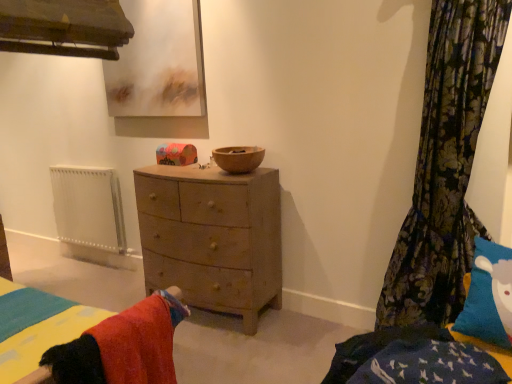
Question: Choose the correct answer: Is floral fabric curtain at right inside white metallic radiator at left or outside it?

Choices:
 (A) inside
 (B) outside

Answer: (B)

Question: Would you say floral fabric curtain at right is to the left or to the right of white metallic radiator at left in the picture?

Choices:
 (A) left
 (B) right

Answer: (B)

Question: Estimate the real-world distances between objects in this image. Which object is farther from the white metallic radiator at left?

Choices:
 (A) wooden chest of drawers at center
 (B) soft cotton bed at center
 (C) wooden bowl at center
 (D) floral fabric curtain at right
 (E) matte wooden picture frame at upper center

Answer: (D)

Question: Estimate the real-world distances between objects in this image. Which object is closer to the soft cotton bed at center?

Choices:
 (A) white metallic radiator at left
 (B) wooden bowl at center
 (C) floral fabric curtain at right
 (D) matte wooden picture frame at upper center
 (E) wooden chest of drawers at center

Answer: (E)